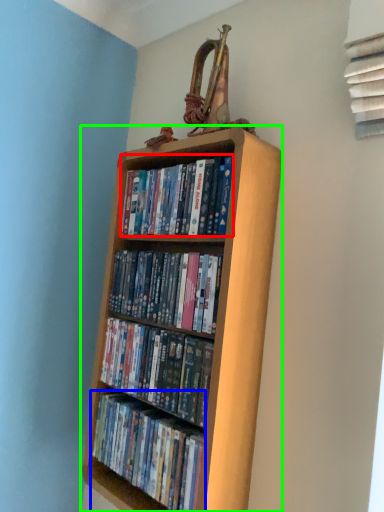
Question: Based on their relative distances, which object is farther from book (highlighted by a red box)? Choose from book (highlighted by a blue box) and bookcase (highlighted by a green box).

Choices:
 (A) book
 (B) bookcase

Answer: (A)